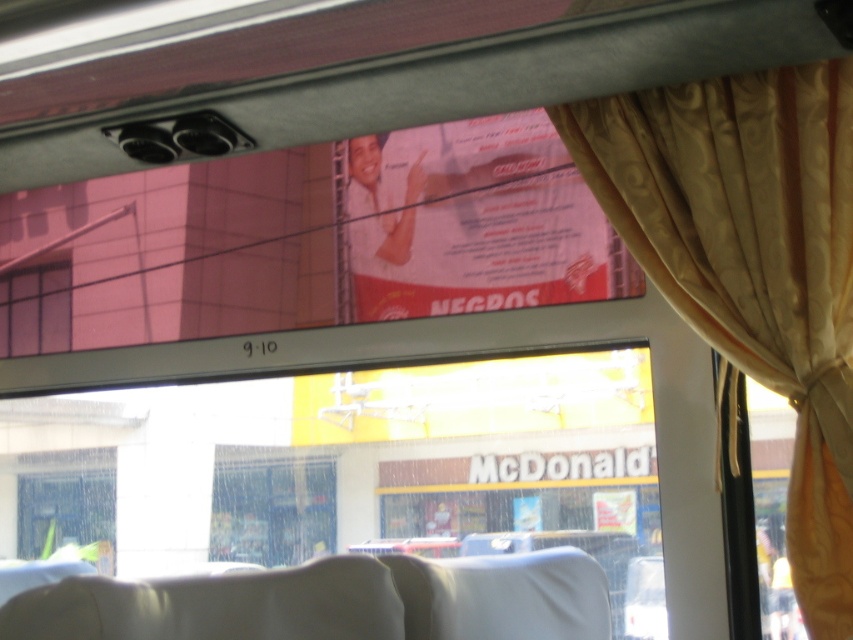
Which of these two, gold satin curtain at right or red glossy poster at upper center, stands taller?

gold satin curtain at right

Which is in front, point (704, 221) or point (503, 141)?

Positioned in front is point (704, 221).

The width and height of the screenshot is (853, 640). What are the coordinates of `gold satin curtain at right` in the screenshot? It's located at (751, 268).

Find the location of a particular element. The height and width of the screenshot is (640, 853). gold satin curtain at right is located at coordinates (751, 268).

Who is lower down, red glossy poster at upper center or pink glass window at upper left?

Positioned lower is pink glass window at upper left.

Which of these two, red glossy poster at upper center or pink glass window at upper left, stands shorter?

pink glass window at upper left is shorter.

I want to click on red glossy poster at upper center, so click(473, 221).

Does gold satin curtain at right come in front of pink glass window at upper left?

That is True.

Does gold satin curtain at right come behind pink glass window at upper left?

No.

Is point (747, 232) farther from camera compared to point (15, 298)?

No, (747, 232) is closer to viewer.

Where is `gold satin curtain at right`? gold satin curtain at right is located at coordinates click(751, 268).